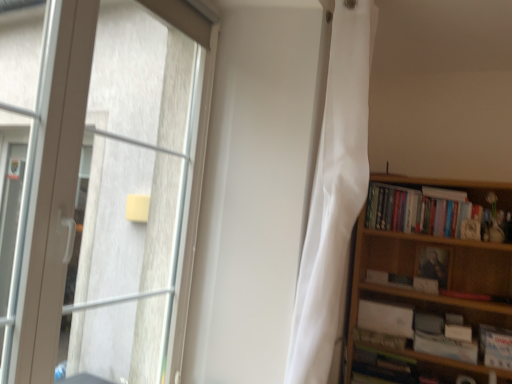
Question: Is white paper book at right, the 4th book viewed from the top, turned away from transparent glass window at left?

Choices:
 (A) yes
 (B) no

Answer: (B)

Question: From the image's perspective, would you say white paper book at right, the 4th book viewed from the top, is positioned over transparent glass window at left?

Choices:
 (A) no
 (B) yes

Answer: (A)

Question: Considering the relative sizes of white paper book at right, the 4th book viewed from the top, and transparent glass window at left in the image provided, is white paper book at right, the 4th book viewed from the top, wider than transparent glass window at left?

Choices:
 (A) yes
 (B) no

Answer: (A)

Question: Is white paper book at right, marked as the second book in a bottom-to-top arrangement, with transparent glass window at left?

Choices:
 (A) no
 (B) yes

Answer: (A)

Question: From a real-world perspective, is white paper book at right, marked as the second book in a bottom-to-top arrangement, positioned over transparent glass window at left based on gravity?

Choices:
 (A) yes
 (B) no

Answer: (B)

Question: Is white paper book at right, marked as the second book in a bottom-to-top arrangement, further to camera compared to transparent glass window at left?

Choices:
 (A) no
 (B) yes

Answer: (B)

Question: Is white matte paperback book at lower right, which appears as the first paperback book when ordered from the bottom, directly adjacent to white silky curtain at center?

Choices:
 (A) no
 (B) yes

Answer: (A)

Question: Does white matte paperback book at lower right, which appears as the first paperback book when ordered from the bottom, have a lesser height compared to white silky curtain at center?

Choices:
 (A) yes
 (B) no

Answer: (A)

Question: Does white matte paperback book at lower right, placed as the 2th paperback book when sorted from top to bottom, appear on the left side of white silky curtain at center?

Choices:
 (A) yes
 (B) no

Answer: (B)

Question: Does white matte paperback book at lower right, placed as the 2th paperback book when sorted from top to bottom, have a greater height compared to white silky curtain at center?

Choices:
 (A) yes
 (B) no

Answer: (B)

Question: Could you tell me if white matte paperback book at lower right, which appears as the first paperback book when ordered from the bottom, is facing white silky curtain at center?

Choices:
 (A) yes
 (B) no

Answer: (B)

Question: Is white matte paperback book at lower right, which appears as the first paperback book when ordered from the bottom, further to the viewer compared to white silky curtain at center?

Choices:
 (A) yes
 (B) no

Answer: (A)

Question: From the image's perspective, does hardcover book at lower right, the fifth book from the top, appear lower than white paper book at right, marked as the second book in a bottom-to-top arrangement?

Choices:
 (A) yes
 (B) no

Answer: (A)